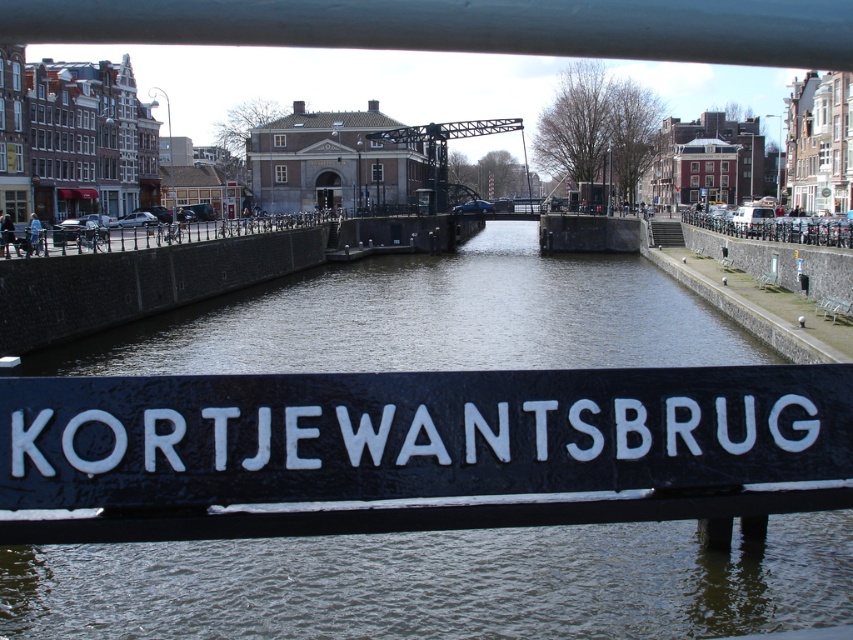
You are standing on the black metal railing with the name KORTJEWANTSBRUG painted in white capital letters. You see a point marked at coordinates (x=436, y=584). Based on the scene, where is this point located?

The point at coordinates (x=436, y=584) is on the black water at center.

You are standing on the bridge named KORTJEWANTSBRUG and looking down at the scene. Which object is closer to you between the black water at center and the black painted wood sign at center?

The black water at center is closer to you than the black painted wood sign at center.

You are a tourist standing on the bridge named KORTJEWANTSBRUG. You notice two black objects at the center of your view. One is labeled as black water at center and the other as black painted wood sign at center. Which object is closer to you?

The black water at center is positioned over the black painted wood sign at center, so the black painted wood sign at center is closer to you.